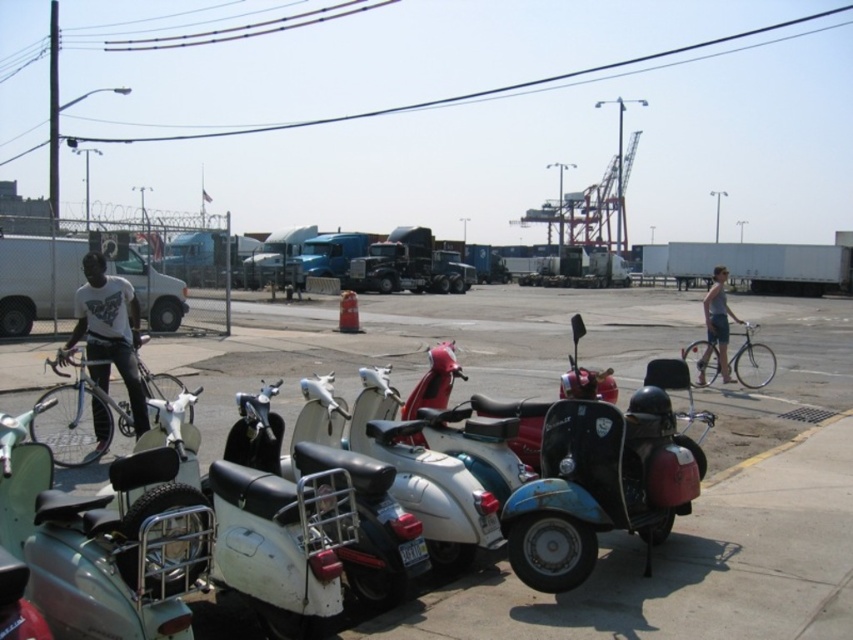
Question: Which of these objects is positioned closest to the shiny silver bicycle at left?

Choices:
 (A) skinny jeans at right
 (B) metallic scooters at center

Answer: (B)

Question: Is metallic silver scooter at lower left to the left of white matte shirt at center from the viewer's perspective?

Choices:
 (A) no
 (B) yes

Answer: (A)

Question: Is shiny silver bicycle at left smaller than silver metallic bicycle at right?

Choices:
 (A) yes
 (B) no

Answer: (A)

Question: Which of the following is the farthest from the observer?

Choices:
 (A) (582, 355)
 (B) (724, 588)
 (C) (1, 461)

Answer: (A)

Question: Which object is farther from the camera taking this photo?

Choices:
 (A) skinny jeans at right
 (B) silver metallic bicycle at right
 (C) shiny silver bicycle at left

Answer: (A)

Question: Does metallic scooters at center appear under skinny jeans at right?

Choices:
 (A) yes
 (B) no

Answer: (A)